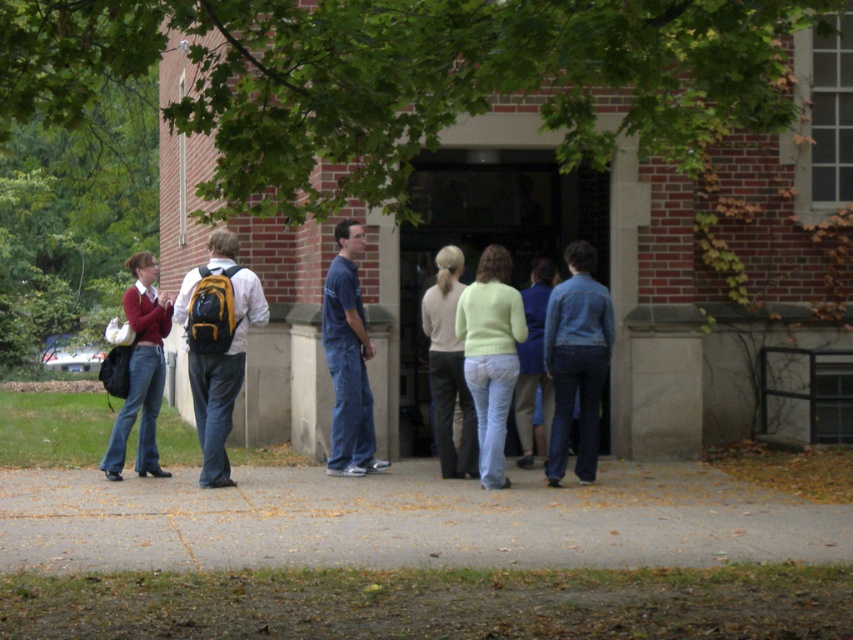
You are standing at the entrance of the brick building and want to take a photo of the green leafy tree at upper center. What are the coordinates where you should aim your camera?

The coordinates to aim your camera are at point [405,80].

You are standing in front of the brick building and notice a green leafy tree at upper center and a light green sweater at center. Which object is nearer to you?

The green leafy tree at upper center is closer to the viewer than the light green sweater at center.

You are a photographer standing in front of the brick building. You notice the green leafy tree at upper center and the light green sweater at center. Which object is taller from your viewpoint?

The light green sweater at center is taller than the green leafy tree at upper center.